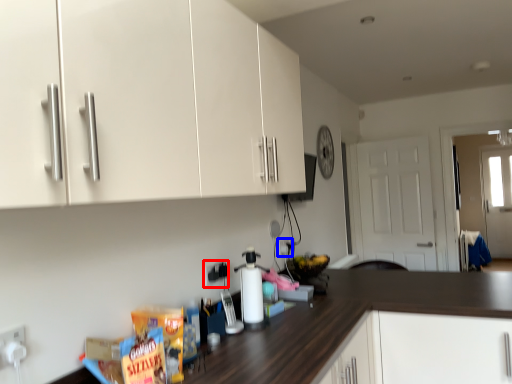
Question: Among these objects, which one is farthest to the camera, electric outlet (highlighted by a red box) or electric outlet (highlighted by a blue box)?

Choices:
 (A) electric outlet
 (B) electric outlet

Answer: (B)